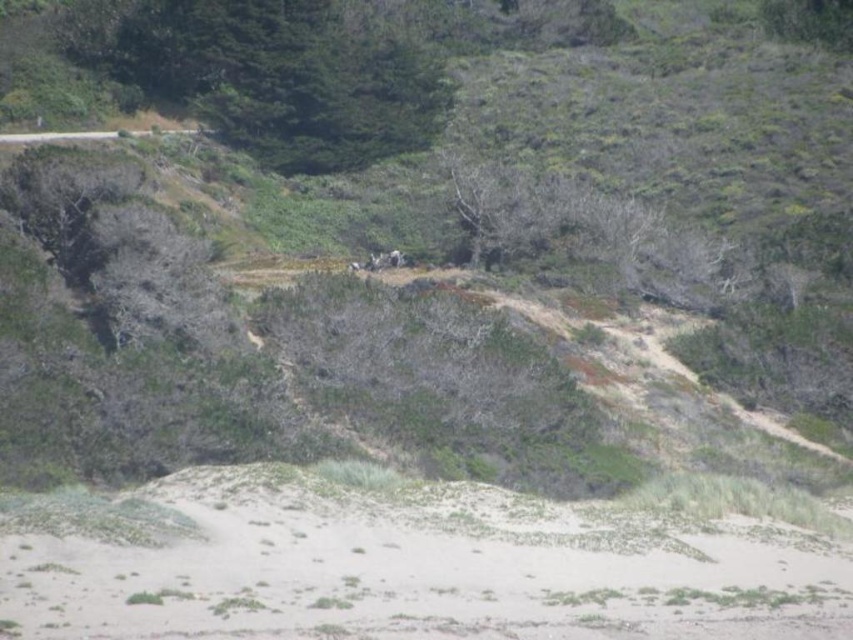
You are standing on the white sandy beach at lower center. There is a point marked at coordinates (401, 564). Is this point located on the beach or somewhere else in the image?

The point marked at coordinates (401, 564) is located on the white sandy beach at lower center according to the description.

You are standing at the sandy area in the foreground of the landscape. You see two points marked on the slope covered with vegetation. The first point is labeled as point (553, 634) and the second is point (410, 83). Which point is closer to you?

Point (553, 634) is in front of point (410, 83), so it is closer to you.

You are standing on the white sandy beach at lower center and want to reach the green leafy tree at upper center. Which direction should you move to get closer to the tree?

You should move upward from the white sandy beach at lower center to reach the green leafy tree at upper center since the tree is located in the upper section of the image.